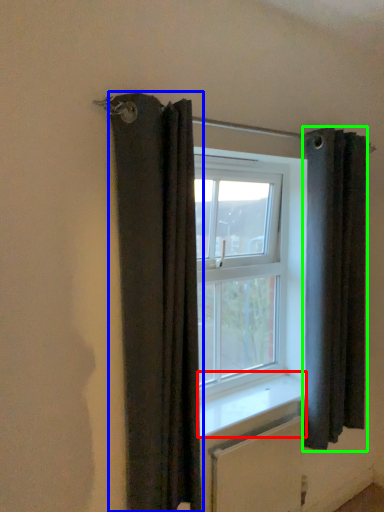
Question: Based on their relative distances, which object is farther from window sill (highlighted by a red box)? Choose from curtain (highlighted by a blue box) and curtain (highlighted by a green box).

Choices:
 (A) curtain
 (B) curtain

Answer: (A)